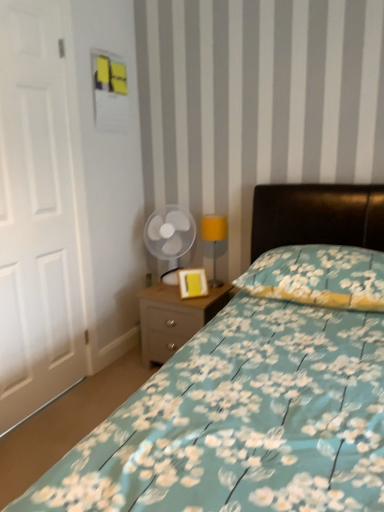
The image size is (384, 512). I want to click on vacant region to the left of yellow matte picture frame at center, so click(164, 297).